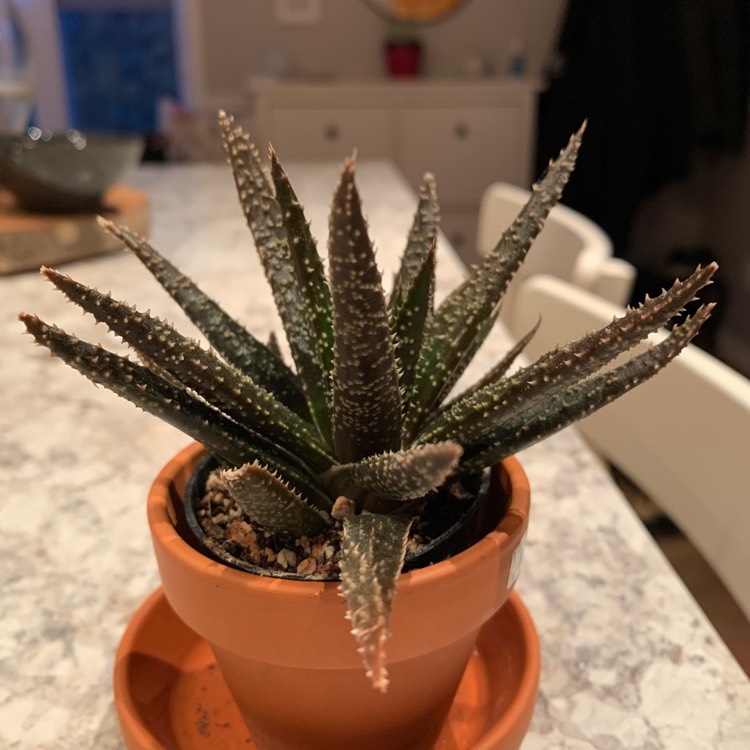
The image size is (750, 750). Find the location of `door`. door is located at coordinates (142, 49).